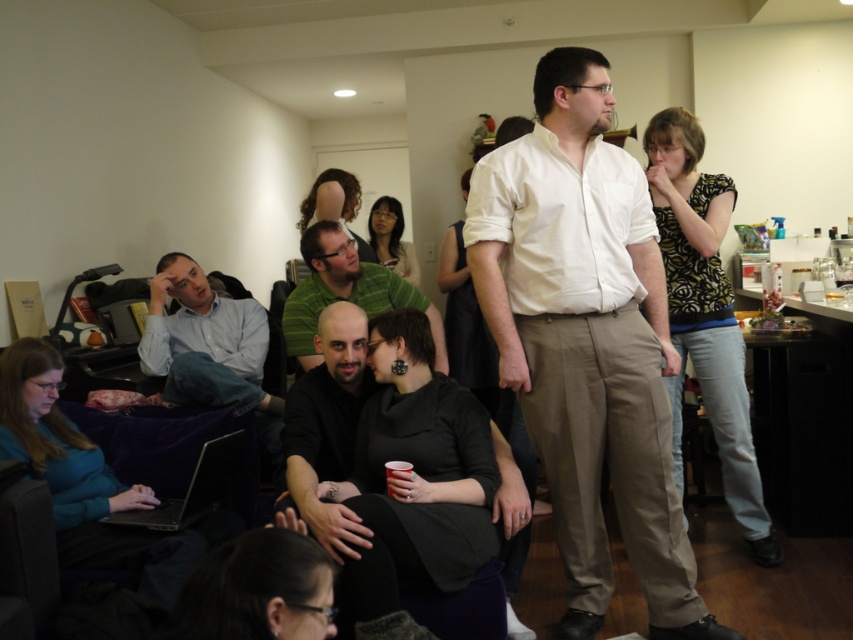
Question: Which point appears closest to the camera in this image?

Choices:
 (A) (573, 422)
 (B) (213, 442)

Answer: (A)

Question: Among these objects, which one is nearest to the camera?

Choices:
 (A) black glossy laptop at lower left
 (B) matte blue shirt at left
 (C) green matte shirt at center
 (D) black matte shirt at center

Answer: (D)

Question: In this image, where is white cotton shirt at center located relative to black glossy laptop at lower left?

Choices:
 (A) above
 (B) below

Answer: (A)

Question: Does black matte shirt at center have a lesser width compared to black glossy laptop at lower left?

Choices:
 (A) yes
 (B) no

Answer: (B)

Question: Observing the image, what is the correct spatial positioning of matte blue shirt at left in reference to white paper cup at lower center?

Choices:
 (A) above
 (B) below

Answer: (A)

Question: Estimate the real-world distances between objects in this image. Which object is closer to the matte blue shirt at left?

Choices:
 (A) black matte shirt at center
 (B) black glossy laptop at lower left

Answer: (A)